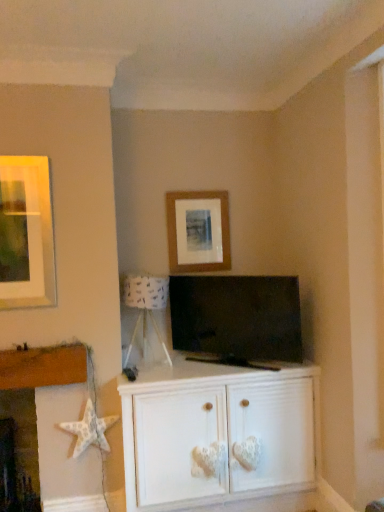
Question: Does matte black tv at center appear on the right side of wooden picture frame at center?

Choices:
 (A) yes
 (B) no

Answer: (A)

Question: From a real-world perspective, does matte black tv at center stand above wooden picture frame at center?

Choices:
 (A) no
 (B) yes

Answer: (A)

Question: Does matte black tv at center have a lesser height compared to wooden picture frame at center?

Choices:
 (A) no
 (B) yes

Answer: (A)

Question: Does matte black tv at center have a lesser width compared to wooden picture frame at center?

Choices:
 (A) no
 (B) yes

Answer: (A)

Question: Is the depth of matte black tv at center less than that of wooden picture frame at center?

Choices:
 (A) yes
 (B) no

Answer: (A)

Question: Considering the relative positions of matte black tv at center and white textured star at lower left in the image provided, is matte black tv at center to the left or to the right of white textured star at lower left?

Choices:
 (A) left
 (B) right

Answer: (B)

Question: Is matte black tv at center spatially inside white textured star at lower left, or outside of it?

Choices:
 (A) inside
 (B) outside

Answer: (B)

Question: Does point (249, 314) appear closer or farther from the camera than point (44, 372)?

Choices:
 (A) closer
 (B) farther

Answer: (B)

Question: Is matte black tv at center taller or shorter than white textured star at lower left?

Choices:
 (A) tall
 (B) short

Answer: (B)

Question: Would you say matte black tv at center is to the left or to the right of white paper lampshade at center in the picture?

Choices:
 (A) left
 (B) right

Answer: (B)

Question: Considering their positions, is matte black tv at center located in front of or behind white paper lampshade at center?

Choices:
 (A) front
 (B) behind

Answer: (A)

Question: Is matte black tv at center taller or shorter than white paper lampshade at center?

Choices:
 (A) tall
 (B) short

Answer: (A)

Question: Is point (274, 338) positioned closer to the camera than point (125, 279)?

Choices:
 (A) farther
 (B) closer

Answer: (B)

Question: Based on their sizes in the image, would you say wooden picture frame at center is bigger or smaller than white painted wood cabinet at center?

Choices:
 (A) small
 (B) big

Answer: (A)

Question: In terms of width, does wooden picture frame at center look wider or thinner when compared to white painted wood cabinet at center?

Choices:
 (A) wide
 (B) thin

Answer: (B)